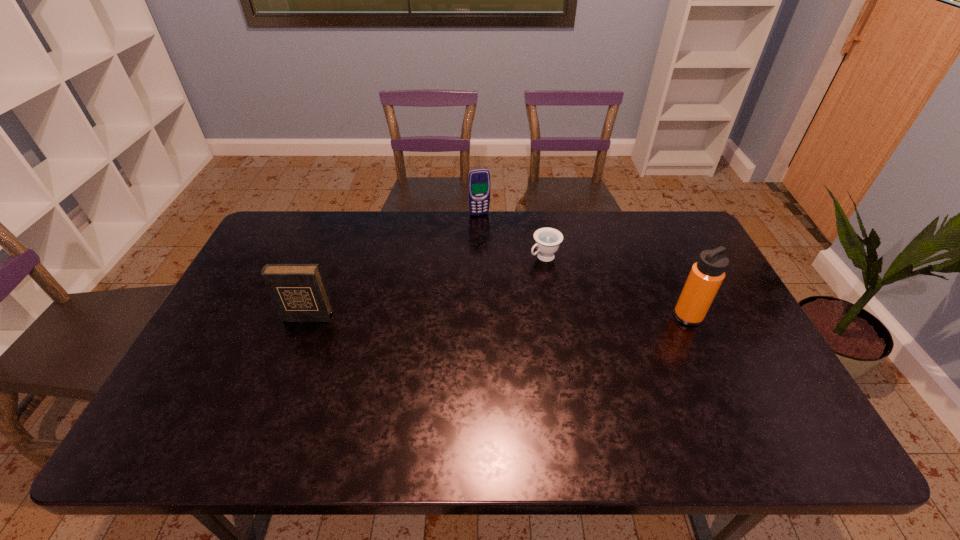
You are a GUI agent. You are given a task and a screenshot of the screen. Output one action in this format:
    pyautogui.click(x=<x>, y=<y>)
    Task: Click on the vacant space situated 0.210m on the side of the second farthest object with the handle
    This screenshot has width=960, height=540.
    Given the screenshot: What is the action you would take?
    pyautogui.click(x=484, y=295)

The image size is (960, 540). Find the location of `free space located on the side of the second farthest object with the handle`. free space located on the side of the second farthest object with the handle is located at coordinates [x=479, y=298].

In order to click on free point located on the front-facing side of the second object from left to right in this screenshot , I will do `click(486, 232)`.

I want to click on vacant position located 0.170m on the front-facing side of the second object from left to right, so click(x=491, y=246).

This screenshot has width=960, height=540. I want to click on vacant space located 0.060m on the front-facing side of the second object from left to right, so click(484, 226).

The height and width of the screenshot is (540, 960). In order to click on teacup that is at the far edge in this screenshot , I will do `click(547, 240)`.

Find the location of a particular element. The image size is (960, 540). cellular telephone that is positioned at the far edge is located at coordinates (478, 179).

I want to click on object that is positioned at the right edge, so click(x=707, y=274).

The width and height of the screenshot is (960, 540). Identify the location of vacant space at the far edge of the desktop. (519, 254).

I want to click on blank space at the left edge, so click(259, 296).